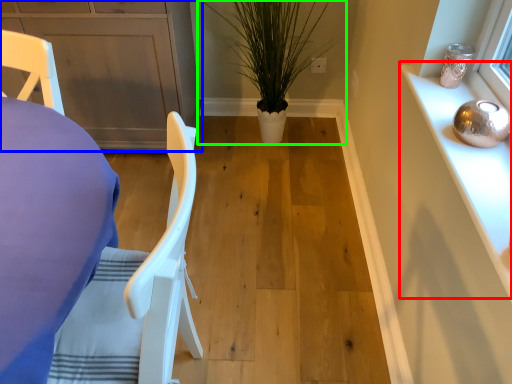
Question: Which object is positioned farthest from cabinetry (highlighted by a red box)? Select from cabinetry (highlighted by a blue box) and houseplant (highlighted by a green box).

Choices:
 (A) cabinetry
 (B) houseplant

Answer: (A)